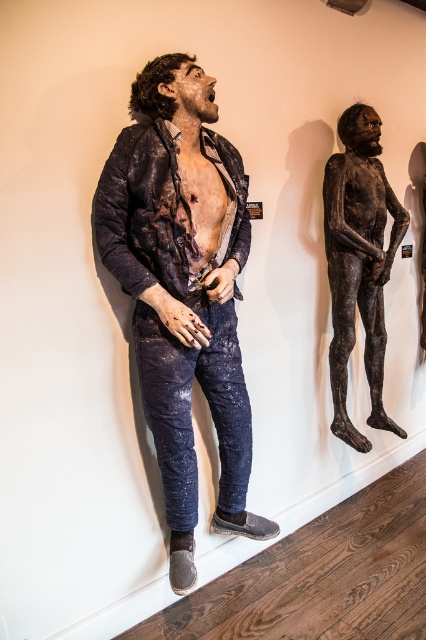
You are standing in front of an art exhibit with two figures. The first is a life sized sculpture on the left wearing a dark, tattered jacket and jeans, and the second is a point at coordinate (181,349) on the right. If you want to place a small plaque between them, how far apart should the plaque be from each figure in feet?

The two figures are 5.57 feet apart. To place the plaque exactly halfway between them, it should be 2.785 feet away from each figure.

You are an art curator preparing to install these two items in a gallery. The gallery has a 1.5 meter wide display case. The distressed denim jacket at center and bronze statue at right need to be placed side by side. Can both items fit in the display case if the jacket is twice the width of the statue?

The distressed denim jacket at center is larger in size than the bronze statue at right. If the jacket is twice the width of the statue, then the total width required would be three times the statue width. Since the display case is 1.5 meters wide, unless the statue is less than 0.5 meters wide, they may not fit. However, without exact measurements, it is uncertain. The given information only states the jacket is larger, not the exact dimensions.

You are an art curator planning to install a new light fixture in the exhibit. The light needs to be placed directly above the distressed denim jacket at center. According to the coordinates provided, where should the light fixture be positioned?

The light fixture should be positioned at point [183,289] directly above the distressed denim jacket at center as specified in the coordinates.